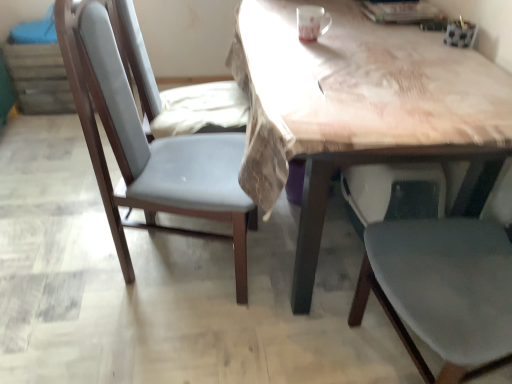
Locate an element on the screen. vacant area located to the right-hand side of matte gray chair at center is located at coordinates (292, 280).